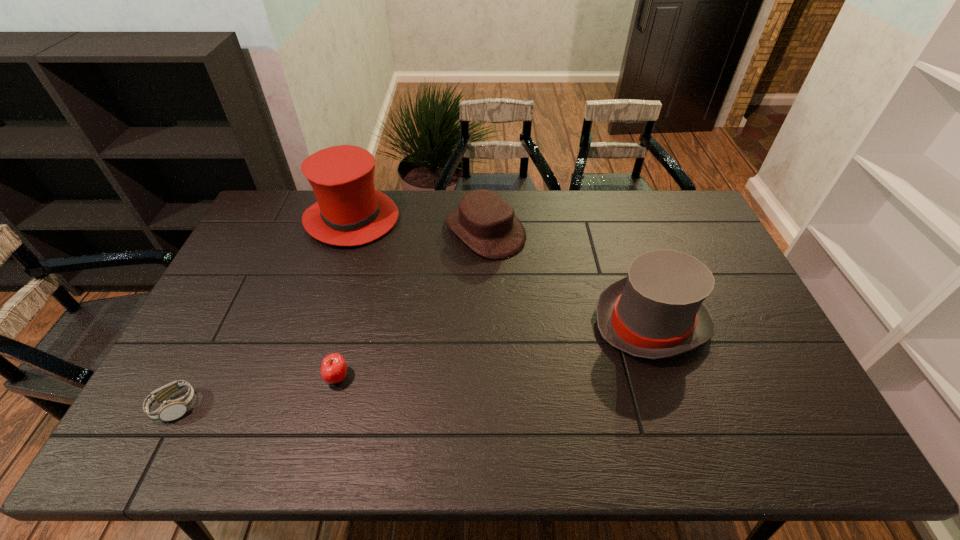
I want to click on free location that satisfies the following two spatial constraints: 1. on the front side of the tallest hat; 2. on the left side of the third shortest object, so click(x=348, y=231).